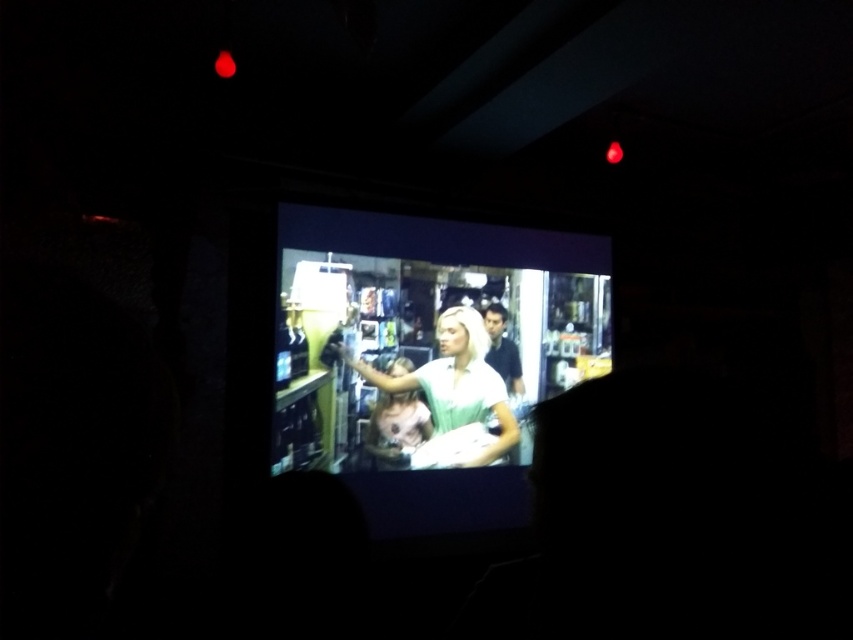
Which is in front, point (440, 240) or point (433, 372)?

Point (433, 372) is in front.

Is point (381, 420) closer to camera compared to point (483, 369)?

Yes, point (381, 420) is in front of point (483, 369).

Who is more forward, (x=305, y=445) or (x=503, y=412)?

Point (x=305, y=445)

The height and width of the screenshot is (640, 853). Identify the location of matte plastic screen at center. (424, 337).

Which is above, matte white shirt at center or smooth white shirt at center?

smooth white shirt at center is above.

Can you confirm if matte white shirt at center is shorter than smooth white shirt at center?

In fact, matte white shirt at center may be taller than smooth white shirt at center.

Is point (466, 317) positioned before point (517, 394)?

Yes.

The image size is (853, 640). I want to click on matte white shirt at center, so click(454, 394).

I want to click on matte plastic screen at center, so click(x=424, y=337).

Which is more to the left, matte plastic screen at center or smooth white shirt at center?

matte plastic screen at center

Image resolution: width=853 pixels, height=640 pixels. Identify the location of matte plastic screen at center. (424, 337).